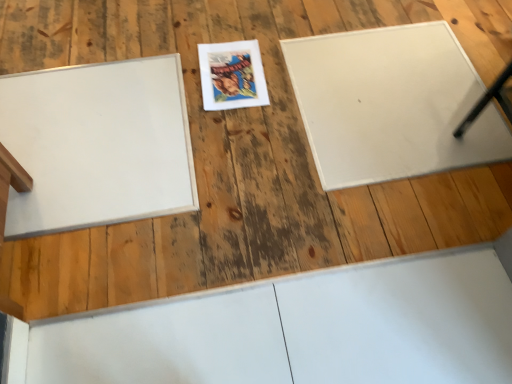
Question: Does white matte board at upper right, which is the 2th bulletin board in left-to-right order, have a greater height compared to white matte board at left, which is the first bulletin board in left-to-right order?

Choices:
 (A) no
 (B) yes

Answer: (A)

Question: From the image's perspective, would you say white matte board at upper right, which appears as the 1th bulletin board when viewed from the right, is shown under white matte board at left, which is the first bulletin board in left-to-right order?

Choices:
 (A) no
 (B) yes

Answer: (A)

Question: Is white matte board at upper right, which is the 2th bulletin board in left-to-right order, bigger than white matte board at left, which appears as the 2th bulletin board when viewed from the right?

Choices:
 (A) yes
 (B) no

Answer: (A)

Question: Does white matte board at upper right, which appears as the 1th bulletin board when viewed from the right, come behind white matte board at left, which is the first bulletin board in left-to-right order?

Choices:
 (A) yes
 (B) no

Answer: (A)

Question: Does white matte board at upper right, which is the 2th bulletin board in left-to-right order, have a smaller size compared to white matte board at left, which is the first bulletin board in left-to-right order?

Choices:
 (A) no
 (B) yes

Answer: (A)

Question: Is white matte board at upper right, which is the 2th bulletin board in left-to-right order, not within white matte board at left, which is the first bulletin board in left-to-right order?

Choices:
 (A) yes
 (B) no

Answer: (A)

Question: From a real-world perspective, does matte paper comic book at center stand above white matte board at upper right, which is the 2th bulletin board in left-to-right order?

Choices:
 (A) yes
 (B) no

Answer: (A)

Question: Is matte paper comic book at center positioned behind white matte board at upper right, which appears as the 1th bulletin board when viewed from the right?

Choices:
 (A) no
 (B) yes

Answer: (B)

Question: Is the depth of matte paper comic book at center less than that of white matte board at upper right, which is the 2th bulletin board in left-to-right order?

Choices:
 (A) yes
 (B) no

Answer: (B)

Question: Is matte paper comic book at center oriented towards white matte board at upper right, which appears as the 1th bulletin board when viewed from the right?

Choices:
 (A) yes
 (B) no

Answer: (B)

Question: Would you say matte paper comic book at center is outside white matte board at upper right, which is the 2th bulletin board in left-to-right order?

Choices:
 (A) no
 (B) yes

Answer: (B)

Question: From the image's perspective, is matte paper comic book at center over white matte board at upper right, which appears as the 1th bulletin board when viewed from the right?

Choices:
 (A) no
 (B) yes

Answer: (B)

Question: From a real-world perspective, does matte paper comic book at center sit lower than white matte board at left, which appears as the 2th bulletin board when viewed from the right?

Choices:
 (A) yes
 (B) no

Answer: (B)